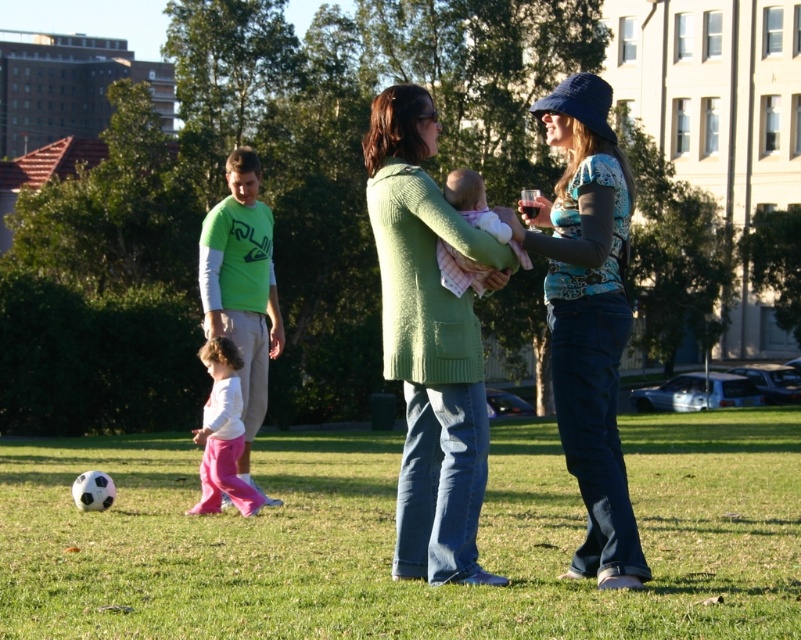
You are standing at the point marked by the coordinates point (242, 289). You want to walk directly towards the green long sleeved shirt at center. Which direction should you go?

The green long sleeved shirt at center is located at point (242, 289), so you are already at the same location as the green long sleeved shirt at center. Therefore, you don t need to move in any direction.